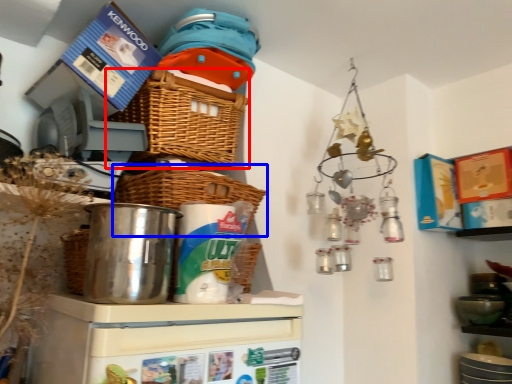
Question: Which object appears closest to the camera in this image, basket (highlighted by a red box) or basket (highlighted by a blue box)?

Choices:
 (A) basket
 (B) basket

Answer: (B)